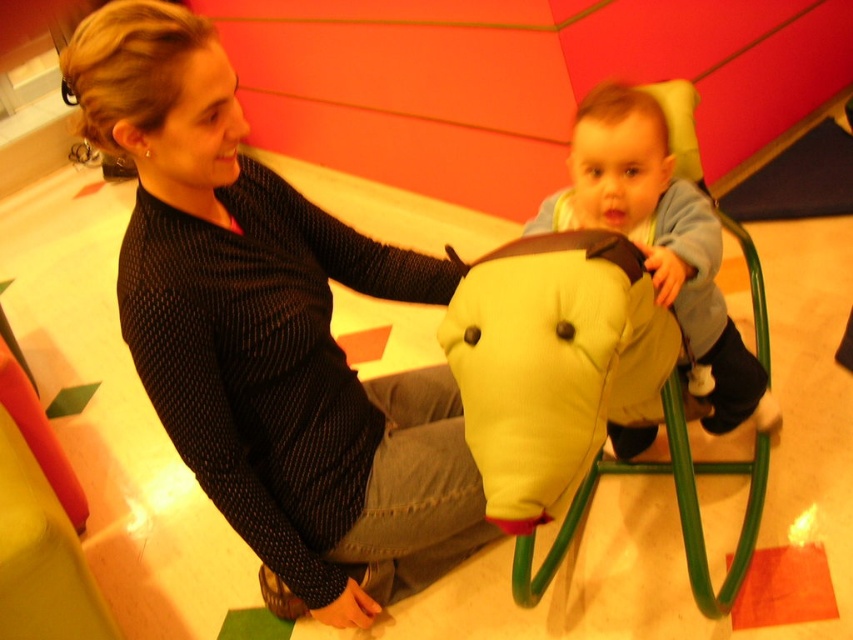
Question: Which of the following is the closest to the observer?

Choices:
 (A) soft yellow plush at center
 (B) soft yellow fabric elephant at center

Answer: (B)

Question: Which of these objects is positioned farthest from the black dotted sweater at upper left?

Choices:
 (A) soft yellow fabric elephant at center
 (B) soft yellow plush at center

Answer: (B)

Question: Which of the following is the closest to the observer?

Choices:
 (A) coord(613,193)
 (B) coord(466,356)

Answer: (B)

Question: Does black dotted sweater at upper left have a lesser width compared to soft yellow fabric elephant at center?

Choices:
 (A) no
 (B) yes

Answer: (A)

Question: Can you confirm if black dotted sweater at upper left is smaller than soft yellow fabric elephant at center?

Choices:
 (A) yes
 (B) no

Answer: (B)

Question: Can you confirm if black dotted sweater at upper left is positioned to the right of soft yellow fabric elephant at center?

Choices:
 (A) yes
 (B) no

Answer: (B)